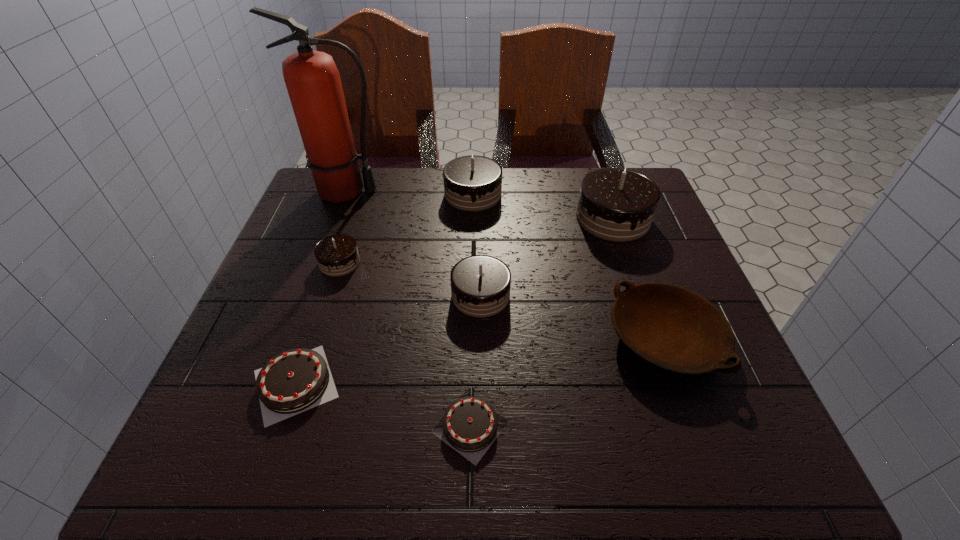
The width and height of the screenshot is (960, 540). I want to click on the tallest object, so click(313, 82).

Find the location of a particular element. the rightmost chocolate cake is located at coordinates (615, 204).

Where is `the biggest chocolate chocolate cake`? the biggest chocolate chocolate cake is located at coordinates (615, 204).

Locate an element on the screen. The image size is (960, 540). the third smallest chocolate chocolate cake is located at coordinates (471, 183).

Locate an element on the screen. the fifth shortest chocolate cake is located at coordinates (471, 183).

Image resolution: width=960 pixels, height=540 pixels. I want to click on the third biggest chocolate chocolate cake, so click(480, 284).

You are a GUI agent. You are given a task and a screenshot of the screen. Output one action in this format:
    pyautogui.click(x=<x>, y=<y>)
    Task: Click on the fourth shortest chocolate cake
    This screenshot has height=540, width=960.
    Given the screenshot: What is the action you would take?
    pyautogui.click(x=480, y=284)

The image size is (960, 540). Find the location of `the third shortest chocolate cake`. the third shortest chocolate cake is located at coordinates (337, 255).

Find the location of `the leftmost chocolate chocolate cake`. the leftmost chocolate chocolate cake is located at coordinates (337, 255).

This screenshot has width=960, height=540. Find the location of `the sixth tallest object`. the sixth tallest object is located at coordinates (674, 329).